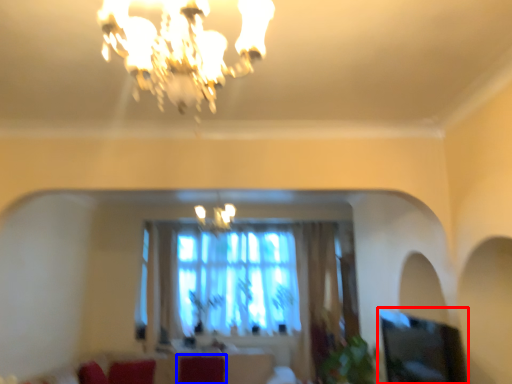
Question: Which point is further to the camera, window screen (highlighted by a red box) or swivel chair (highlighted by a blue box)?

Choices:
 (A) window screen
 (B) swivel chair

Answer: (B)